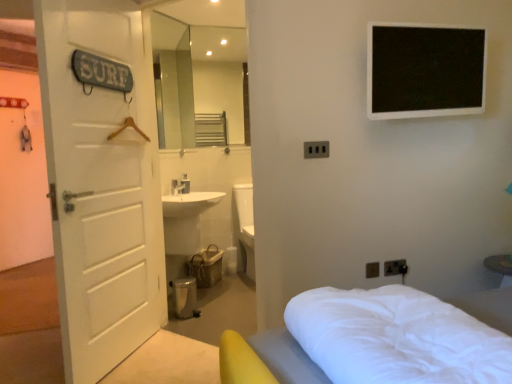
Question: From their relative heights in the image, would you say white wooden door at left is taller or shorter than black plastic electric outlet at center, the first electric outlet in the front-to-back sequence?

Choices:
 (A) short
 (B) tall

Answer: (B)

Question: Is white wooden door at left bigger or smaller than black plastic electric outlet at center, arranged as the first electric outlet when viewed from the left?

Choices:
 (A) big
 (B) small

Answer: (A)

Question: Which object is the farthest from the white soft bed at lower right?

Choices:
 (A) matte black electric outlet at lower right, placed as the 2th electric outlet when sorted from right to left
 (B) black plastic electric outlet at center, which ranks as the third electric outlet in right-to-left order
 (C) white wooden door at left
 (D) black plastic electrical outlet at lower right, which is the first electric outlet from right to left

Answer: (C)

Question: Which object is the farthest from the white soft bed at lower right?

Choices:
 (A) black plastic electrical outlet at lower right, which ranks as the 2th electric outlet in top-to-bottom order
 (B) white wooden door at left
 (C) matte black electric outlet at lower right, which is counted as the 1th electric outlet, starting from the bottom
 (D) black plastic electric outlet at center, marked as the third electric outlet in a back-to-front arrangement

Answer: (B)